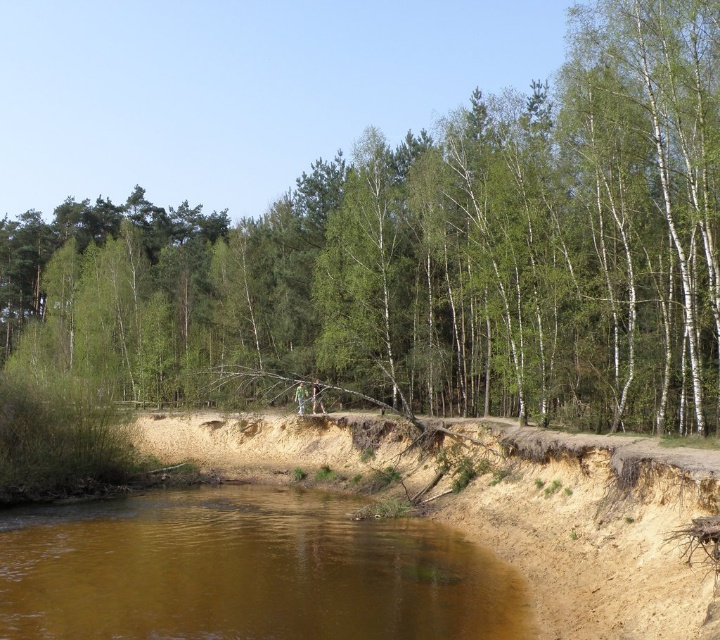
Question: From the image, what is the correct spatial relationship of green leafy tree at center in relation to brown sandy river at lower center?

Choices:
 (A) below
 (B) above

Answer: (B)

Question: Is green leafy tree at center to the left of brown sandy river at lower center from the viewer's perspective?

Choices:
 (A) yes
 (B) no

Answer: (A)

Question: From the image, what is the correct spatial relationship of green leafy tree at center in relation to brown sandy river at lower center?

Choices:
 (A) above
 (B) below

Answer: (A)

Question: Which object appears closest to the camera in this image?

Choices:
 (A) green leafy tree at center
 (B) brown sandy river at lower center

Answer: (B)